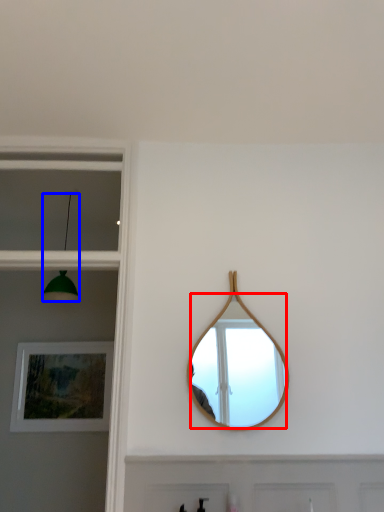
Question: Among these objects, which one is nearest to the camera, mirror (highlighted by a red box) or light fixture (highlighted by a blue box)?

Choices:
 (A) mirror
 (B) light fixture

Answer: (A)